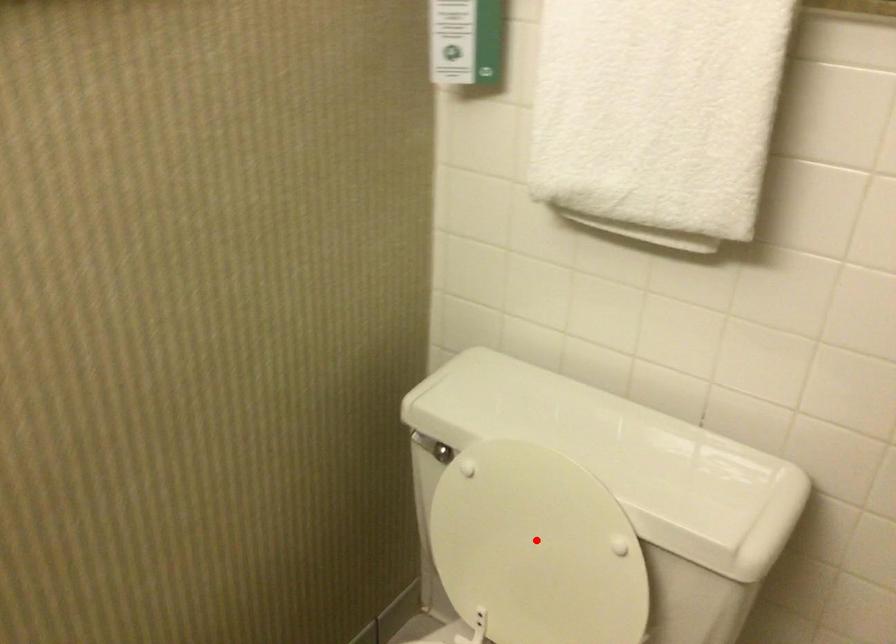
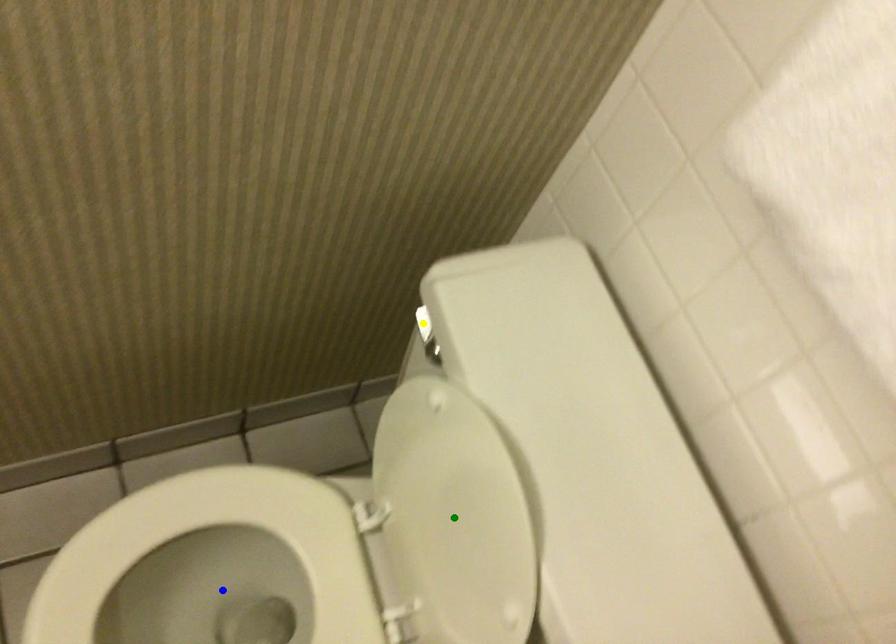
Question: I am providing you with two images of the same scene from different viewpoints. A red point is marked on the first image. You are given multiple points on the second image. In image 2, which mark is for the same physical point as the one in image 1?

Choices:
 (A) yellow point
 (B) blue point
 (C) green point

Answer: (C)